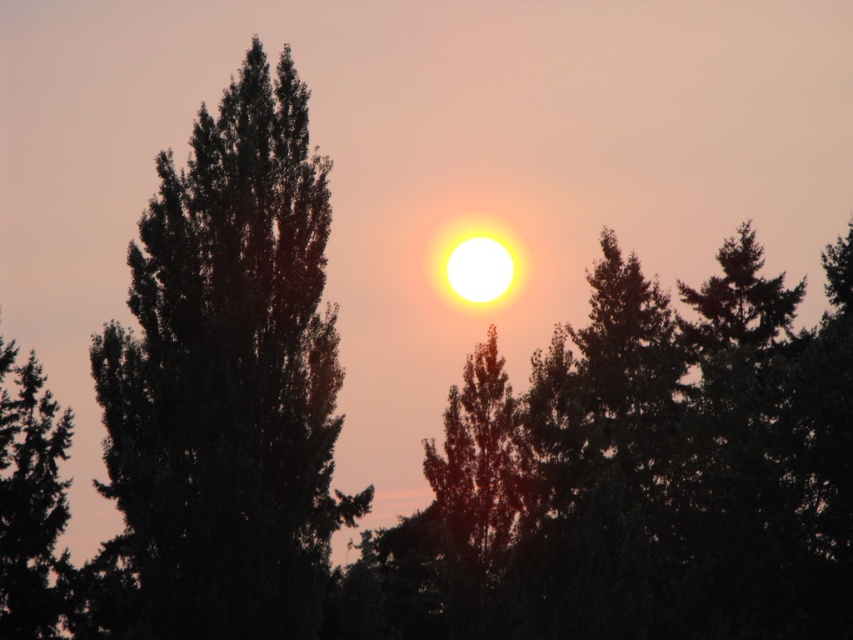
Between dark green leafy tree at left and dark green textured tree at left, which one is positioned higher?

dark green textured tree at left is higher up.

Between dark green leafy tree at left and dark green textured tree at left, which one appears on the left side from the viewer's perspective?

dark green textured tree at left

Locate an element on the screen. This screenshot has height=640, width=853. dark green leafy tree at left is located at coordinates (225, 385).

In order to click on dark green leafy tree at left in this screenshot , I will do `click(225, 385)`.